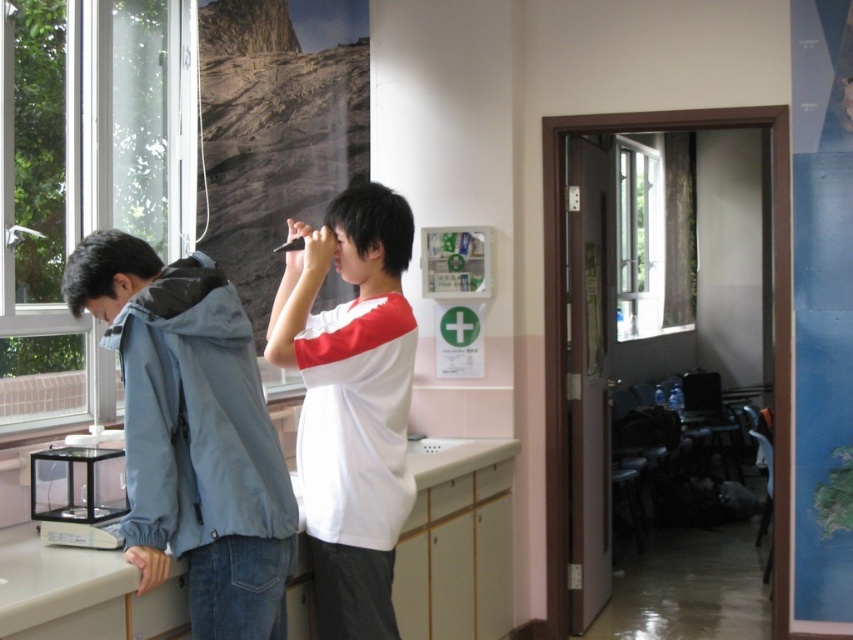
You are standing in the classroom and want to look outside through the transparent glass window at left. Where should you position yourself to see the window?

You should position yourself at point [85,179] to see the transparent glass window at left.

You are standing in the classroom and need to locate the light blue fabric jacket at left. Based on the coordinates given, where should you look to find it?

The light blue fabric jacket at left is located at coordinates point (x=192, y=433).

You are standing in the classroom and want to open the transparent glass window at left to let in some fresh air. Considering the window is 9.13 feet away from you, can you reach it without moving closer?

The transparent glass window at left is 9.13 feet away from viewer, so you cannot reach it without moving closer since the typical human arm reach is about 2.5 to 3 feet.